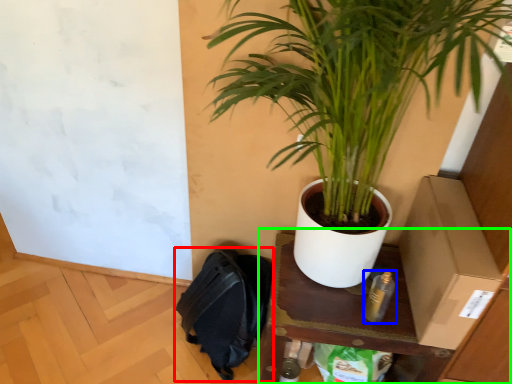
Question: Which is nearer to the backpack (highlighted by a red box)? bottle (highlighted by a blue box) or table (highlighted by a green box).

Choices:
 (A) bottle
 (B) table

Answer: (B)